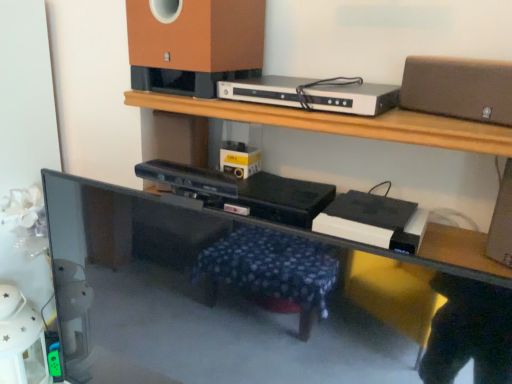
Question: Is silver metallic dvd player at upper center turned away from matte brown speaker at upper right, acting as the 1th speaker starting from the right?

Choices:
 (A) yes
 (B) no

Answer: (B)

Question: Is silver metallic dvd player at upper center not close to matte brown speaker at upper right, placed as the second speaker when sorted from left to right?

Choices:
 (A) no
 (B) yes

Answer: (A)

Question: From the image's perspective, is silver metallic dvd player at upper center under matte brown speaker at upper right, acting as the 1th speaker starting from the right?

Choices:
 (A) no
 (B) yes

Answer: (A)

Question: Is silver metallic dvd player at upper center aimed at matte brown speaker at upper right, placed as the second speaker when sorted from left to right?

Choices:
 (A) no
 (B) yes

Answer: (A)

Question: Is silver metallic dvd player at upper center at the right side of matte brown speaker at upper right, placed as the second speaker when sorted from left to right?

Choices:
 (A) yes
 (B) no

Answer: (B)

Question: Is black glossy computer desk at lower left bigger or smaller than matte brown speaker at upper center, which appears as the 2th speaker when viewed from the right?

Choices:
 (A) big
 (B) small

Answer: (A)

Question: Considering their positions, is black glossy computer desk at lower left located in front of or behind matte brown speaker at upper center, the first speaker in the left-to-right sequence?

Choices:
 (A) front
 (B) behind

Answer: (A)

Question: Is point (458, 309) closer or farther from the camera than point (249, 49)?

Choices:
 (A) farther
 (B) closer

Answer: (B)

Question: From the image's perspective, is black glossy computer desk at lower left above or below matte brown speaker at upper center, the first speaker in the left-to-right sequence?

Choices:
 (A) below
 (B) above

Answer: (A)

Question: Is silver metallic dvd player at upper center spatially inside matte brown speaker at upper right, acting as the 1th speaker starting from the right, or outside of it?

Choices:
 (A) inside
 (B) outside

Answer: (B)

Question: In terms of width, does silver metallic dvd player at upper center look wider or thinner when compared to matte brown speaker at upper right, acting as the 1th speaker starting from the right?

Choices:
 (A) thin
 (B) wide

Answer: (B)

Question: Does point (224, 81) appear closer or farther from the camera than point (416, 74)?

Choices:
 (A) closer
 (B) farther

Answer: (B)

Question: Considering their positions, is silver metallic dvd player at upper center located in front of or behind matte brown speaker at upper right, placed as the second speaker when sorted from left to right?

Choices:
 (A) behind
 (B) front

Answer: (A)

Question: From a real-world perspective, is matte brown speaker at upper center, which appears as the 2th speaker when viewed from the right, physically located above or below silver metallic dvd player at upper center?

Choices:
 (A) below
 (B) above

Answer: (B)

Question: In the image, is matte brown speaker at upper center, the first speaker in the left-to-right sequence, positioned in front of or behind silver metallic dvd player at upper center?

Choices:
 (A) front
 (B) behind

Answer: (B)